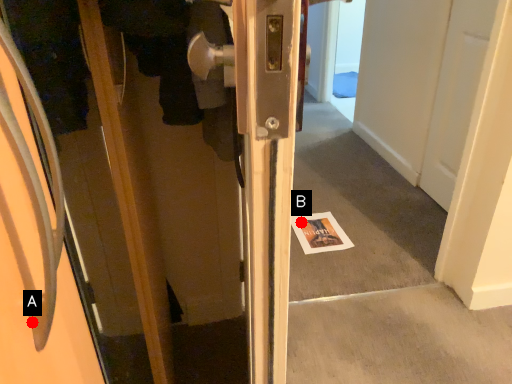
Question: Two points are circled on the image, labeled by A and B beside each circle. Which point is closer to the camera?

Choices:
 (A) A is closer
 (B) B is closer

Answer: (A)